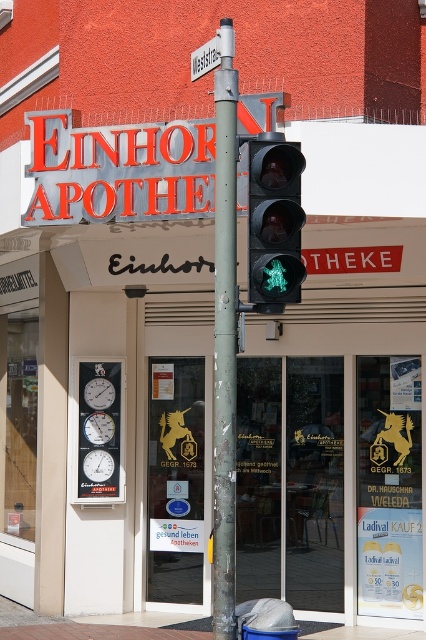
You are a delivery person with a cart that is 12 inches wide. You need to navigate between the green metallic pole at center and the black glass pedestrian signal at center. Can your cart fit through the space between them?

The distance between the green metallic pole at center and the black glass pedestrian signal at center is 11.82 inches, which is slightly narrower than your 12 inches wide cart. Therefore, your cart cannot fit through the space between them.

You are a delivery person standing at the entrance of Einhorn Apotheke. You need to place a package on the nearest object between the black glass pedestrian signal at center and the white plastic street sign at upper center. Which object should you choose?

The black glass pedestrian signal at center is closer to you than the white plastic street sign at upper center because it is only 13.92 feet away. Therefore, you should place the package on the black glass pedestrian signal at center.